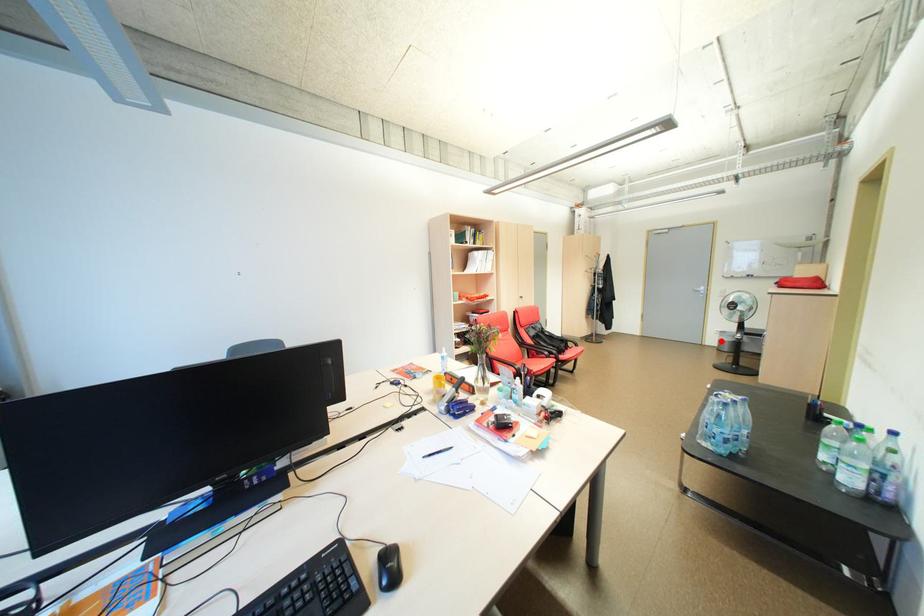
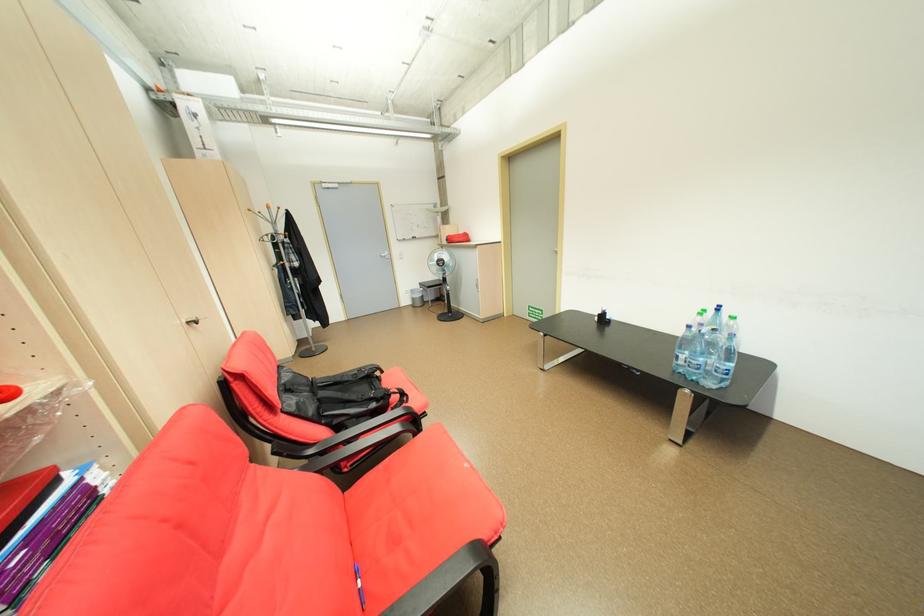
Question: I am providing you with two images of the same scene from different viewpoints. In image1, a red point is highlighted. Considering the same 3D point in image2, which of the following is correct?

Choices:
 (A) It is closer
 (B) It is farther

Answer: (A)